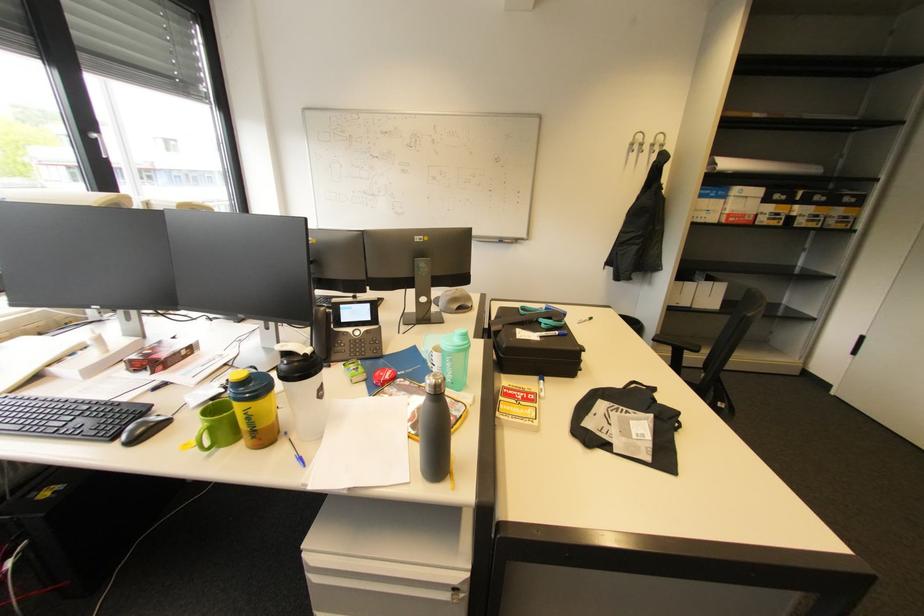
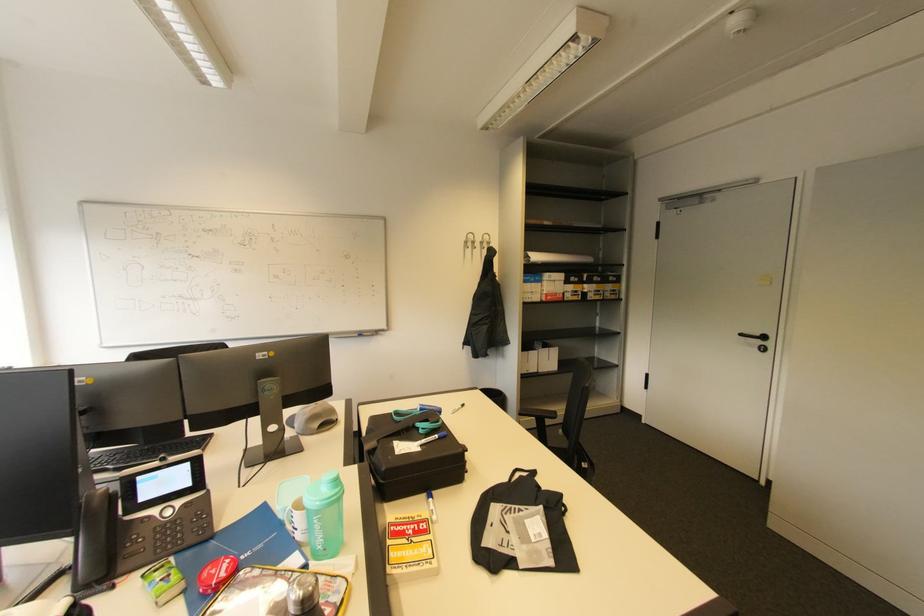
Locate, in the second image, the point that corresponds to pixel 637 423 in the first image.

(531, 523)